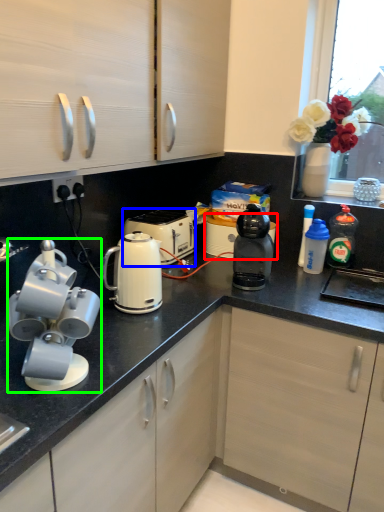
Question: Which is nearer to the appliance (highlighted by a red box)? kettle (highlighted by a blue box) or home appliance (highlighted by a green box).

Choices:
 (A) kettle
 (B) home appliance

Answer: (A)